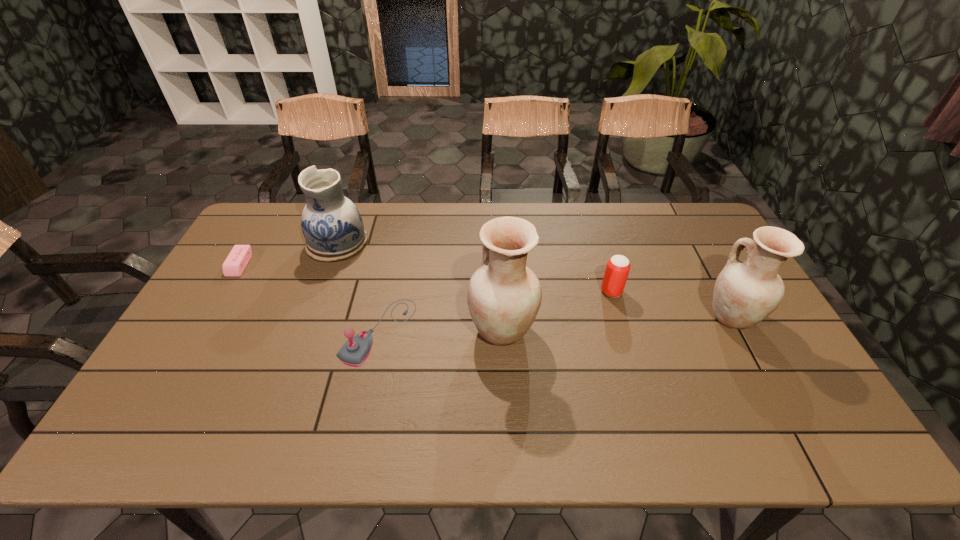
Image resolution: width=960 pixels, height=540 pixels. In order to click on blank region between the tallest object and the fourth object from right to left in this screenshot , I will do `click(441, 330)`.

This screenshot has height=540, width=960. What are the coordinates of `free spot between the joystick and the rightmost object` in the screenshot? It's located at (555, 324).

Where is `vacant region between the fifth object from left to right and the fourth object from left to right`? vacant region between the fifth object from left to right and the fourth object from left to right is located at coordinates coord(557,310).

Find the location of a particular element. vacant area that lies between the third object from right to left and the fourth object from right to left is located at coordinates (441, 330).

Find the location of `object that stands as the closest to the leftmost pottery`. object that stands as the closest to the leftmost pottery is located at coordinates (354, 352).

Choose which object is the fourth nearest neighbor to the rightmost pottery. Please provide its 2D coordinates. Your answer should be formatted as a tuple, i.e. [(x, y)], where the tuple contains the x and y coordinates of a point satisfying the conditions above.

[(332, 225)]

Locate an element on the screen. This screenshot has height=540, width=960. pottery that is the second nearest to the fourth object from left to right is located at coordinates (746, 292).

Choose which pottery is the nearest neighbor to the tallest pottery. Please provide its 2D coordinates. Your answer should be formatted as a tuple, i.e. [(x, y)], where the tuple contains the x and y coordinates of a point satisfying the conditions above.

[(332, 225)]

The width and height of the screenshot is (960, 540). I want to click on free space that satisfies the following two spatial constraints: 1. on the front side of the eraser; 2. on the left side of the rightmost object, so click(209, 317).